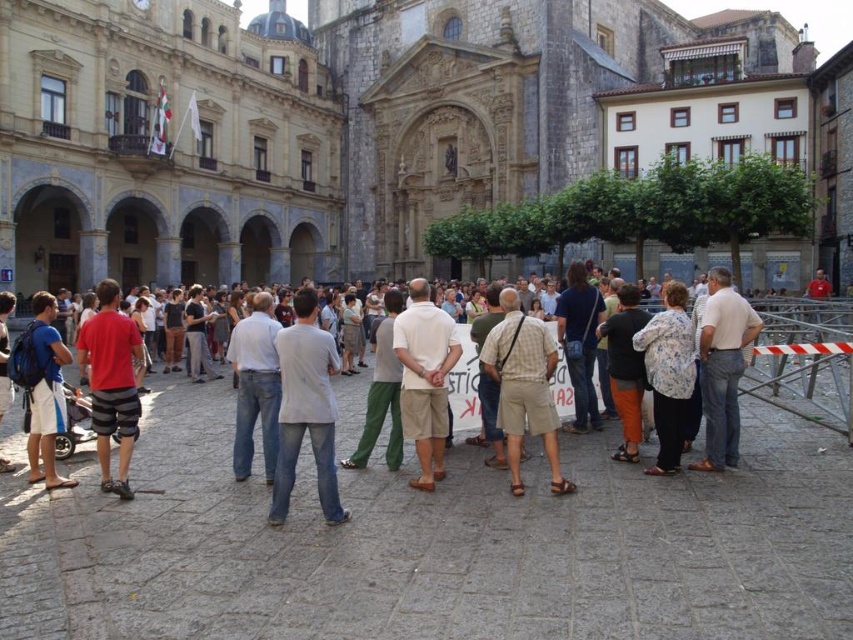
You are standing at the center of the European town square and want to find a person wearing a plaid cotton shirt at center. According to the coordinates provided, where should you look to find this person?

The plaid cotton shirt at center is located at coordinates point (523,387).